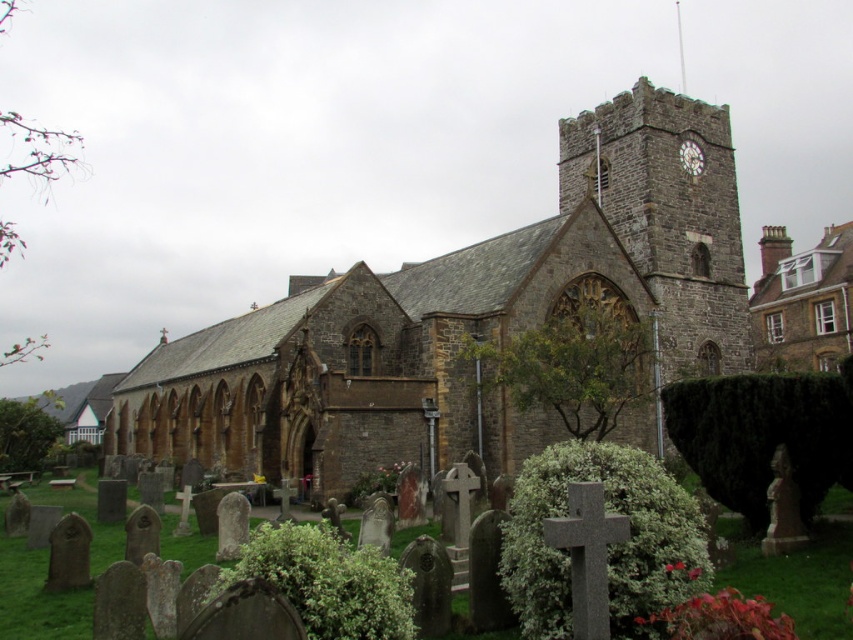
What is the spatial relationship between the brown stone church at center and the matte brown clock at upper right in the image?

The brown stone church at center is positioned on the left side of the matte brown clock at upper right.

You are standing in front of the brown stone church at center and want to see the matte brown clock at upper right. Can you see the clock clearly from your current position?

The brown stone church at center is in front of the matte brown clock at upper right, so the church may block your view of the clock.

From the picture: You are standing at the entrance of the historic stone church and see two points marked in the scene. The first point is at coordinate point [260,332] and the second is at point [849,307]. Which point is closer to you as you face the church?

Point [260,332] is closer to you because it is in front of point [849,307].